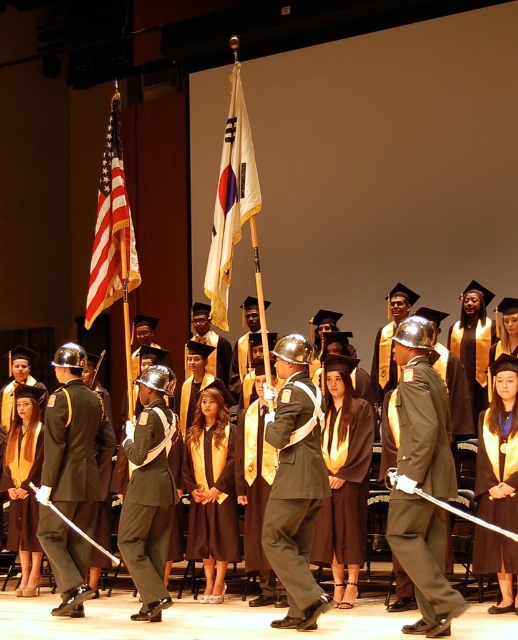
You are an event organizer planning to arrange seating for the graduation ceremony. You need to seat the shiny black uniform at center and the satin black uniform at center side by side. Which uniform requires more space between them to accommodate their sizes?

The shiny black uniform at center requires more space because its width is larger than the satin black uniform at center, so there needs to be more space between them to accommodate its size.

You are a photographer at the ceremony. You want to capture a photo where both the khaki fabric uniform at center and the white fabric flag at center are visible. Which object will appear taller in the photo?

The white fabric flag at center will appear taller in the photo because the khaki fabric uniform at center is not as tall as the white fabric flag at center.

You are an event organizer who needs to arrange seating for two types of uniforms in the front row. The shiny black uniform at center and the satin black uniform at center. Which uniform should be placed on the left side to accommodate its size?

The shiny black uniform at center should be placed on the left side because it has a larger size compared to the satin black uniform at center.